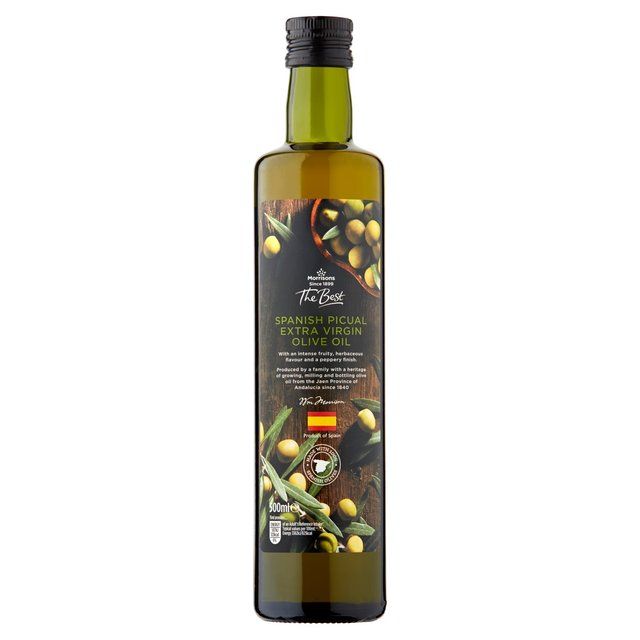
This screenshot has height=640, width=640. I want to click on bottle, so click(x=356, y=177).